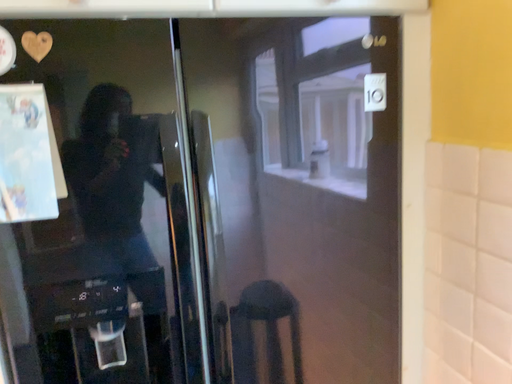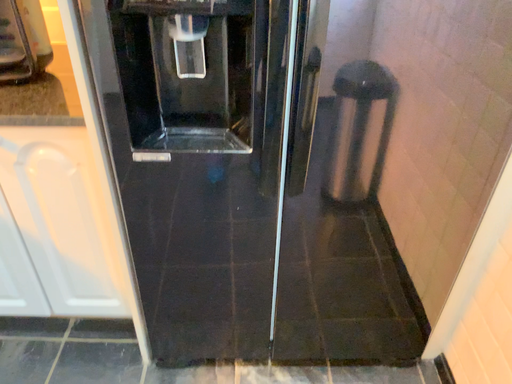
Question: How did the camera likely rotate when shooting the video?

Choices:
 (A) rotated downward
 (B) rotated upward

Answer: (A)